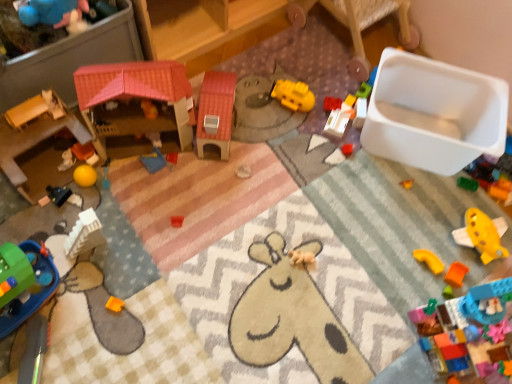
I want to click on vacant area that lies between orange matte block at lower right, which ranks as the second toy in right-to-left order, and smooth wooden dollhouse at left, placed as the 15th toy when sorted from right to left, so click(243, 223).